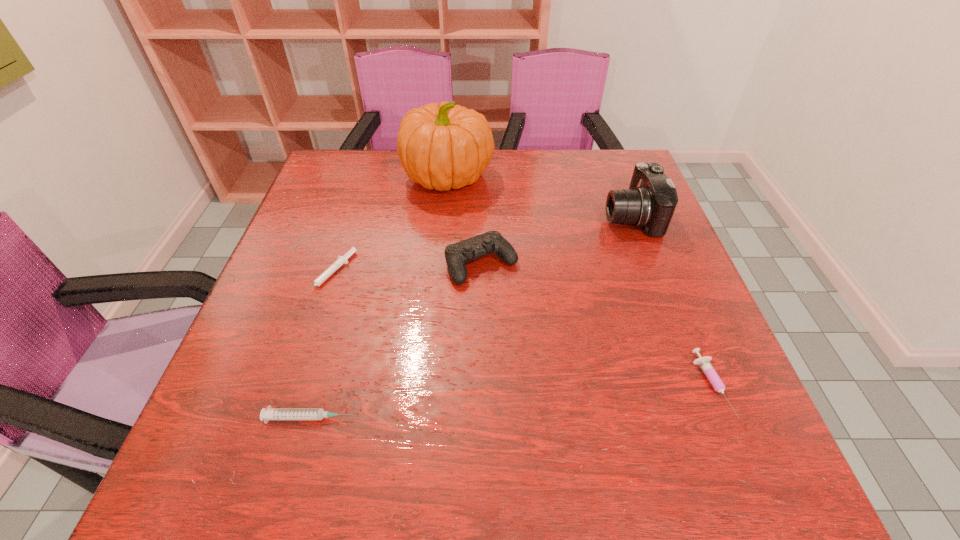
Identify the location of object that is the third closest to the rightmost syringe. The width and height of the screenshot is (960, 540). (441, 146).

Identify which object is located as the fourth nearest to the tallest object. Please provide its 2D coordinates. Your answer should be formatted as a tuple, i.e. [(x, y)], where the tuple contains the x and y coordinates of a point satisfying the conditions above.

[(267, 414)]

You are a GUI agent. You are given a task and a screenshot of the screen. Output one action in this format:
    pyautogui.click(x=<x>, y=<y>)
    Task: Click on the syringe that is the closest to the rightmost syringe
    The image size is (960, 540).
    Given the screenshot: What is the action you would take?
    pyautogui.click(x=267, y=414)

The image size is (960, 540). In order to click on syringe that is the third nearest to the fourth shortest object in this screenshot , I will do `click(704, 362)`.

Image resolution: width=960 pixels, height=540 pixels. Identify the location of free region that satisfies the following two spatial constraints: 1. on the lens of the rightmost syringe; 2. on the right side of the camera. (695, 386).

In order to click on vacant space that satisfies the following two spatial constraints: 1. on the surface of the rightmost syringe; 2. on the left side of the pumpkin in this screenshot , I will do `click(429, 386)`.

Find the location of a particular element. The height and width of the screenshot is (540, 960). blank space that satisfies the following two spatial constraints: 1. on the surface of the control; 2. on the right side of the tallest object is located at coordinates pos(441,264).